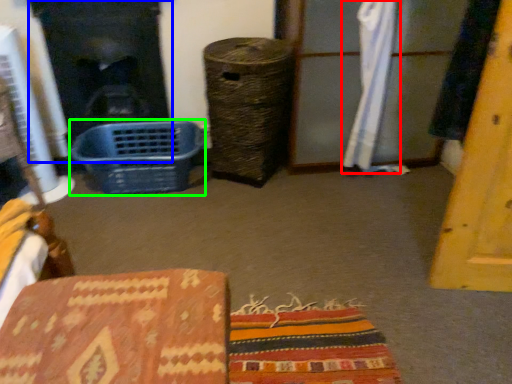
Question: Based on their relative distances, which object is farther from curtain (highlighted by a red box)? Choose from fireplace (highlighted by a blue box) and basket (highlighted by a green box).

Choices:
 (A) fireplace
 (B) basket

Answer: (A)